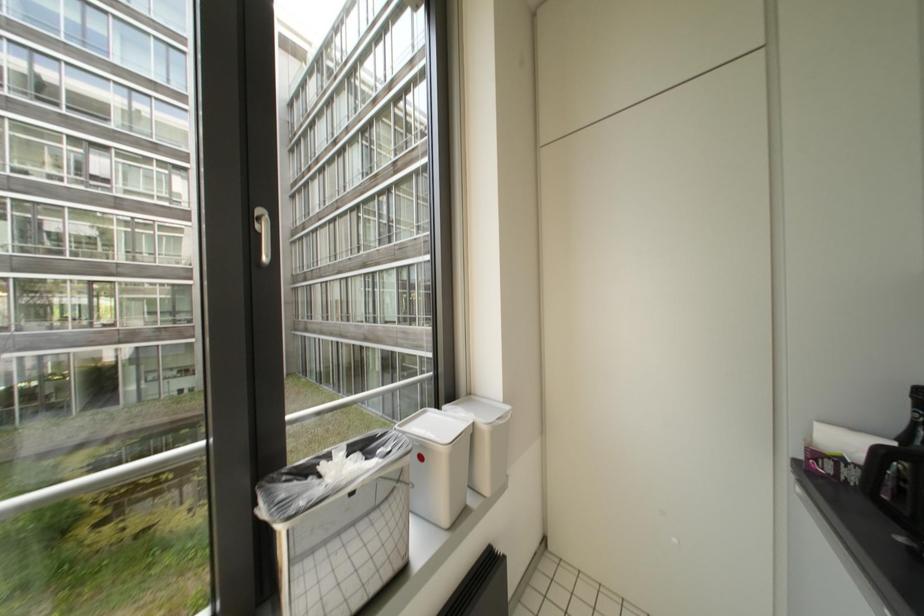
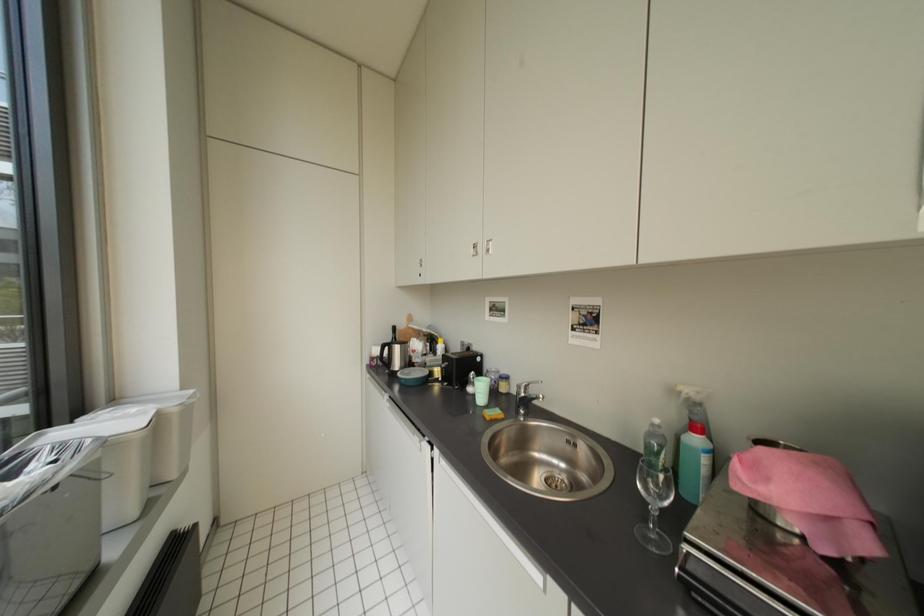
Question: The camera is either moving clockwise (left) or counter-clockwise (right) around the object. The first image is from the beginning of the video and the second image is from the end. Is the camera moving left or right when shooting the video?

Choices:
 (A) Left
 (B) Right

Answer: (A)